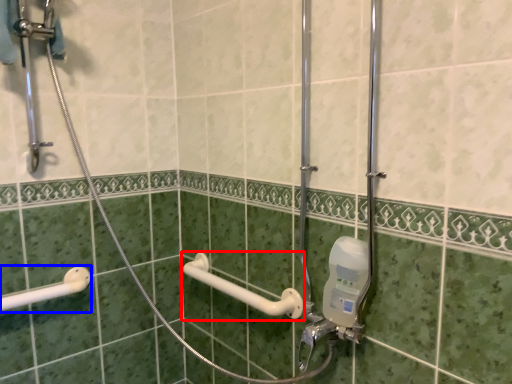
Question: Which object appears farthest to the camera in this image, towel bar (highlighted by a red box) or shower (highlighted by a blue box)?

Choices:
 (A) towel bar
 (B) shower

Answer: (B)